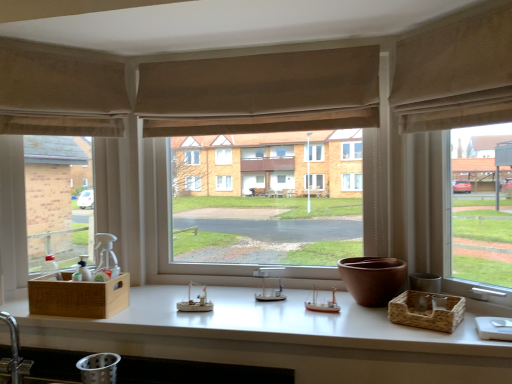
Question: Considering the positions of beige fabric curtain at upper right, which appears as the 2th curtain when viewed from the back, and white matte countertop at center in the image, is beige fabric curtain at upper right, which appears as the 2th curtain when viewed from the back, wider or thinner than white matte countertop at center?

Choices:
 (A) thin
 (B) wide

Answer: (A)

Question: Relative to white matte countertop at center, is beige fabric curtain at upper right, placed as the second curtain when sorted from left to right, in front or behind?

Choices:
 (A) behind
 (B) front

Answer: (A)

Question: Which is nearer to the brown matte vase at center?

Choices:
 (A) beige fabric curtain at upper right, placed as the second curtain when sorted from left to right
 (B) beige textured curtain at center, the first curtain when ordered from left to right
 (C) matte beige curtain at right, which appears as the first window when viewed from the right
 (D) silver metallic faucet at lower left
 (E) matte beige curtain at center, acting as the 2th window starting from the left

Answer: (E)

Question: Which of these objects is positioned farthest from the matte beige curtain at right, which is counted as the third window, starting from the left?

Choices:
 (A) beige fabric curtain at upper right, the 1th curtain when ordered from front to back
 (B) silver metallic faucet at lower left
 (C) beige textured curtain at center, the second curtain positioned from the front
 (D) matte beige curtain at center, acting as the 2th window starting from the left
 (E) brown woven basket at right, the 2th basket from the left

Answer: (B)